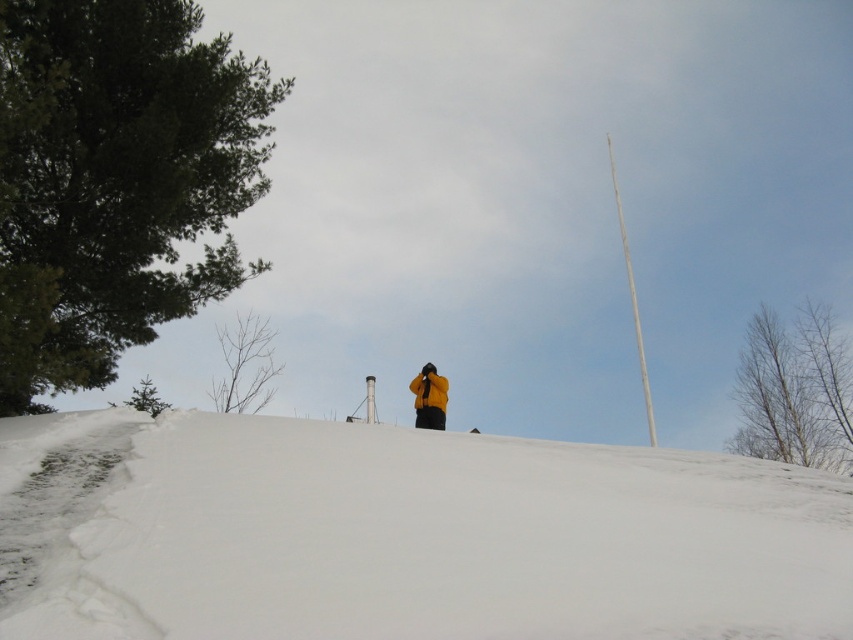
Consider the image. Which of these two, bare branches at left or yellow matte jacket at center, stands taller?

bare branches at left

Is bare branches at left taller than yellow matte jacket at center?

Correct, bare branches at left is much taller as yellow matte jacket at center.

Locate an element on the screen. The height and width of the screenshot is (640, 853). bare branches at left is located at coordinates (244, 365).

Consider the image. Is the position of white fluffy snow at center more distant than that of bare branches at left?

No, white fluffy snow at center is in front of bare branches at left.

Is point (637, 579) positioned after point (270, 372)?

No, it is in front of (270, 372).

Identify the location of white fluffy snow at center. This screenshot has height=640, width=853. (404, 534).

Who is positioned more to the left, bare branches at upper center or yellow matte jacket at center?

From the viewer's perspective, yellow matte jacket at center appears more on the left side.

Who is more forward, (793, 372) or (432, 403)?

Positioned in front is point (432, 403).

Does point (827, 340) come behind point (440, 401)?

Yes, point (827, 340) is behind point (440, 401).

The height and width of the screenshot is (640, 853). Find the location of `bare branches at upper center`. bare branches at upper center is located at coordinates (795, 390).